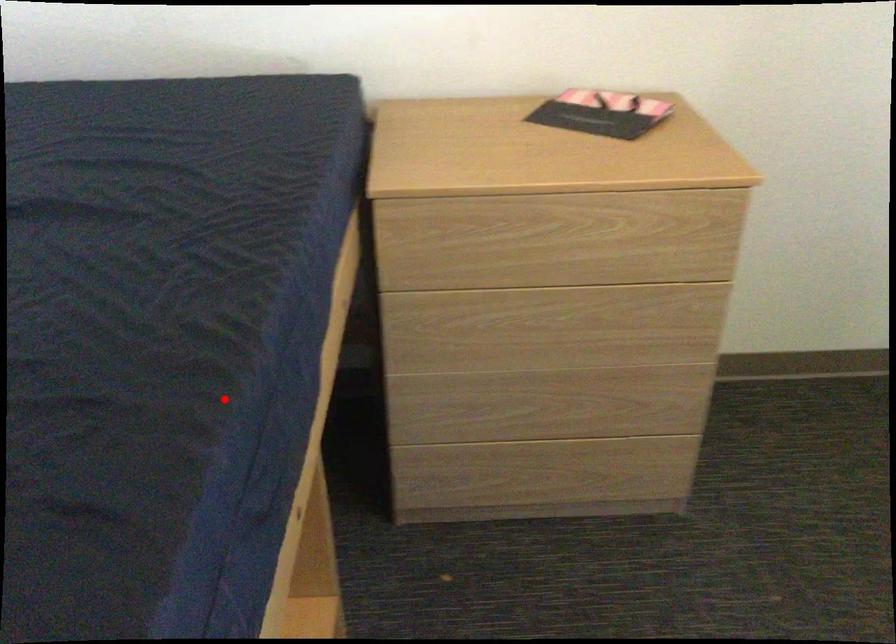
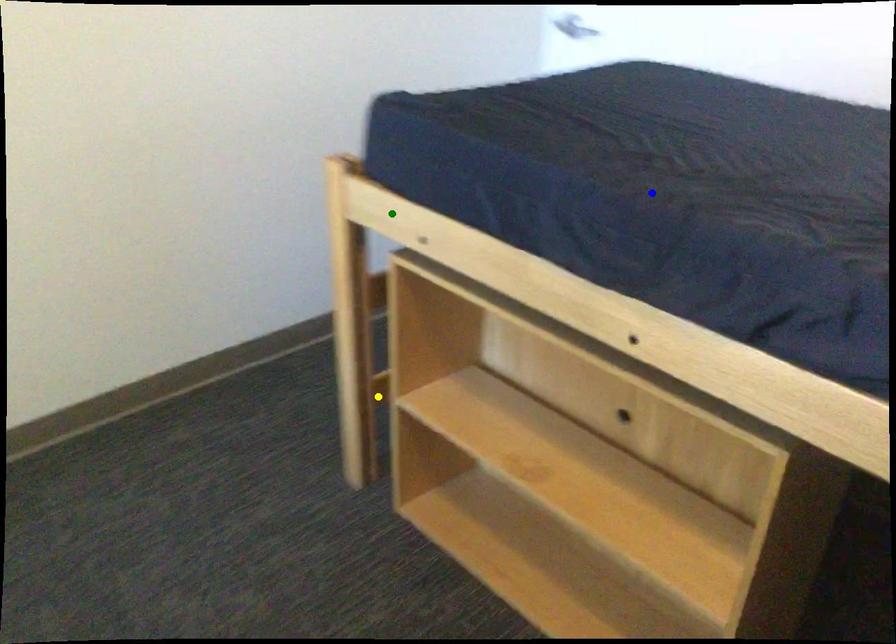
Question: I am providing you with two images of the same scene from different viewpoints. A red point is marked on the first image. You are given multiple points on the second image. Can you choose the point in image 2 that corresponds to the point in image 1?

Choices:
 (A) blue point
 (B) green point
 (C) yellow point

Answer: (A)